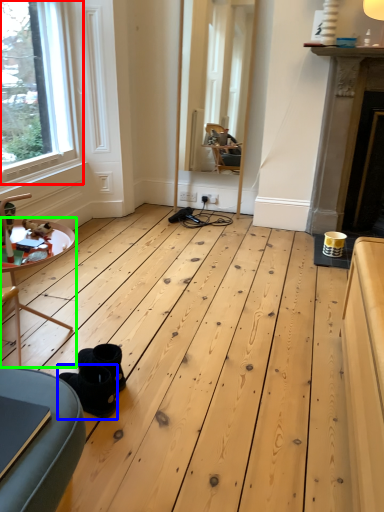
Question: Which object is the closest to the window (highlighted by a red box)? Choose among these: footwear (highlighted by a blue box) or table (highlighted by a green box).

Choices:
 (A) footwear
 (B) table

Answer: (B)